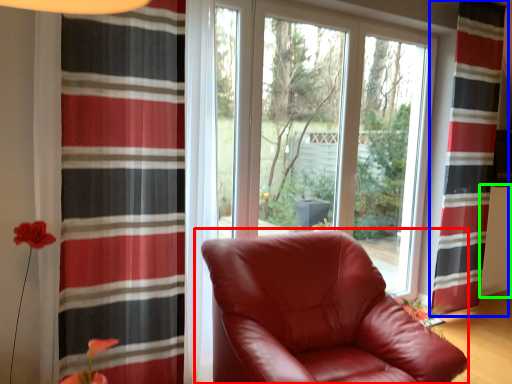
Question: Estimate the real-world distances between objects in this image. Which object is farther from chair (highlighted by a red box), curtain (highlighted by a blue box) or radiator (highlighted by a green box)?

Choices:
 (A) curtain
 (B) radiator

Answer: (B)